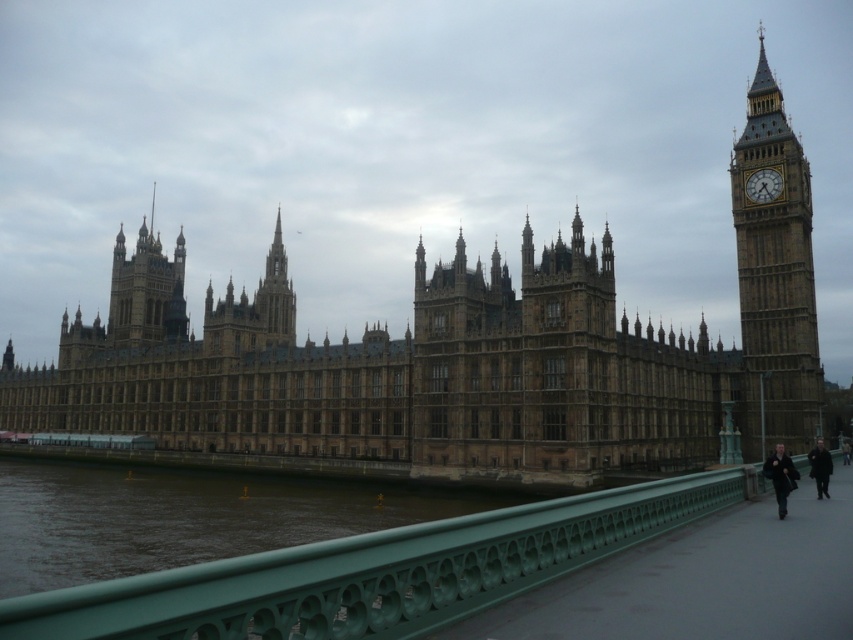
Does dark blue jacket at lower right appear on the left side of dark brown coat at lower right?

Correct, you'll find dark blue jacket at lower right to the left of dark brown coat at lower right.

Which is behind, point (782, 484) or point (824, 461)?

Point (824, 461)

Measure the distance between dark blue jacket at lower right and camera.

197.28 feet

The width and height of the screenshot is (853, 640). Find the location of `dark blue jacket at lower right`. dark blue jacket at lower right is located at coordinates (780, 476).

Who is shorter, green metal railing at lower center or gold stone clock at upper right?

gold stone clock at upper right is shorter.

The height and width of the screenshot is (640, 853). What do you see at coordinates (373, 572) in the screenshot? I see `green metal railing at lower center` at bounding box center [373, 572].

This screenshot has width=853, height=640. Identify the location of green metal railing at lower center. (373, 572).

Does brown stone clock tower at right have a smaller size compared to dark brown coat at lower right?

No, brown stone clock tower at right is not smaller than dark brown coat at lower right.

Looking at this image, between brown stone clock tower at right and dark brown coat at lower right, which one is positioned higher?

brown stone clock tower at right is above.

Which is behind, point (775, 147) or point (820, 493)?

The point (775, 147) is more distant.

The height and width of the screenshot is (640, 853). Identify the location of brown stone clock tower at right. (775, 280).